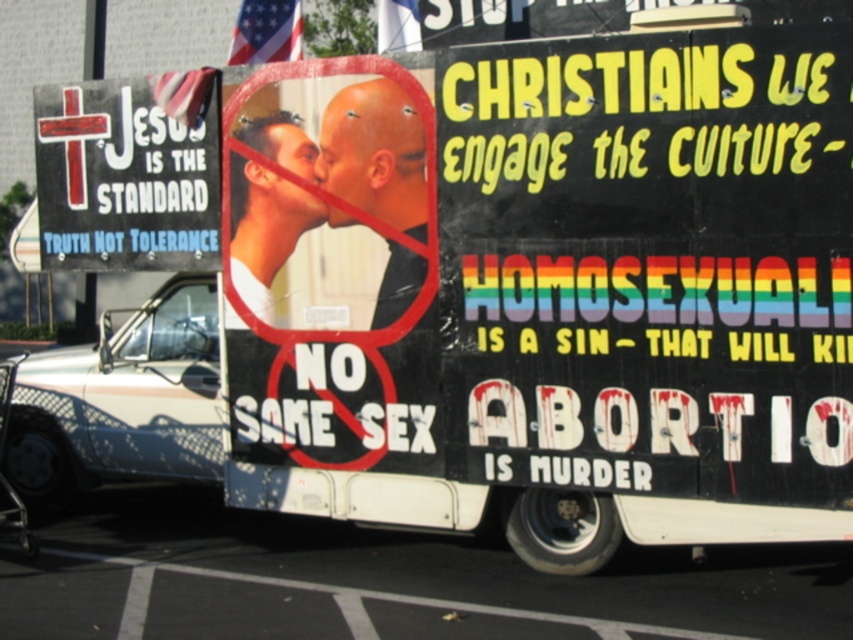
Question: Can you confirm if black painted signboard at center right is positioned above matte white shirt at center?

Choices:
 (A) no
 (B) yes

Answer: (A)

Question: Is black painted signboard at center right closer to camera compared to smooth skin face at center?

Choices:
 (A) yes
 (B) no

Answer: (A)

Question: Among these objects, which one is nearest to the camera?

Choices:
 (A) matte white shirt at center
 (B) black cardboard sign at upper left
 (C) black painted signboard at center right

Answer: (C)

Question: Which point is farther from the camera taking this photo?

Choices:
 (A) (54, 184)
 (B) (410, 134)

Answer: (A)

Question: Is black painted signboard at center right below matte white shirt at center?

Choices:
 (A) no
 (B) yes

Answer: (B)

Question: Among these objects, which one is farthest from the camera?

Choices:
 (A) black cardboard sign at upper left
 (B) smooth skin face at center

Answer: (A)